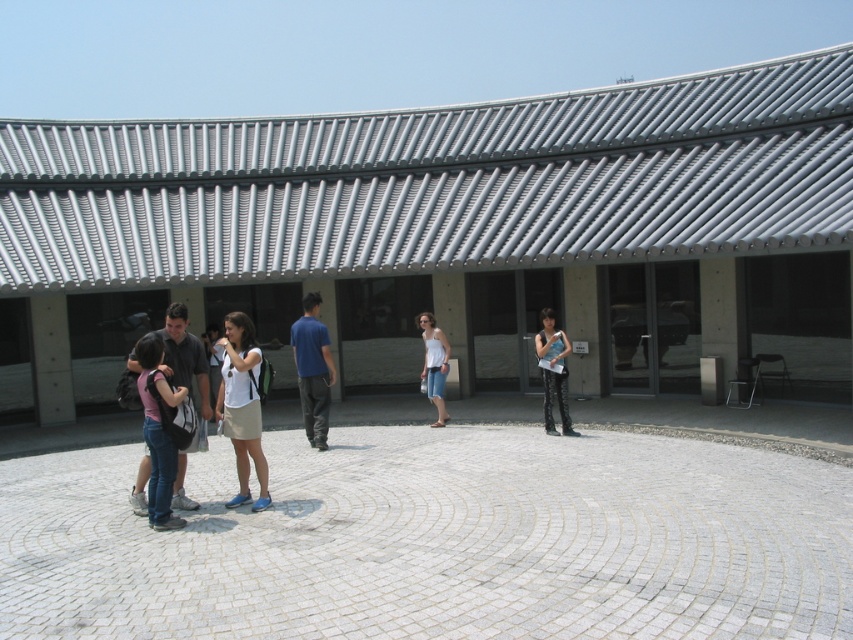
Question: Among these points, which one is farthest from the camera?

Choices:
 (A) (434, 388)
 (B) (165, 449)

Answer: (A)

Question: Does white stone courtyard at center have a larger size compared to blue fabric shirt at center?

Choices:
 (A) yes
 (B) no

Answer: (B)

Question: Considering the real-world distances, which object is closest to the pink fabric shirt at center?

Choices:
 (A) blue fabric shirt at center
 (B) white stone courtyard at center
 (C) denim pants at center

Answer: (B)

Question: In this image, where is white matte shirt at center located relative to denim pants at center?

Choices:
 (A) left
 (B) right

Answer: (A)

Question: Does white stone courtyard at center lie in front of pink fabric shirt at center?

Choices:
 (A) no
 (B) yes

Answer: (A)

Question: Which point is farther to the camera?

Choices:
 (A) (433, 323)
 (B) (611, 476)

Answer: (A)